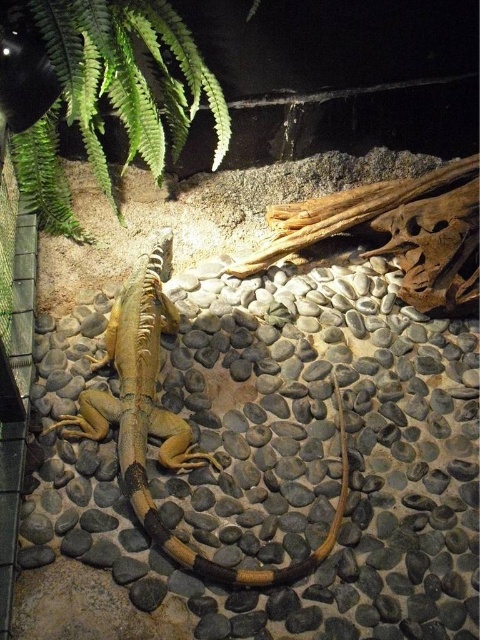
You are a small insect in the terrarium. You want to move from the smooth tan lizard at center to the green leafy plant at upper left. Which direction should you go?

The green leafy plant at upper left is to the left of the smooth tan lizard at center, so you should move to the left to reach it.

You are a reptile keeper and need to ensure the smooth tan lizard at center can reach the green leafy plant at upper left for feeding. The lizard can stretch up to 30 inches. Can it reach the plant?

The green leafy plant at upper left and smooth tan lizard at center are 31.44 inches apart, so the lizard cannot reach the plant as its maximum stretch is 30 inches.

You are a reptile keeper checking the terrarium. You notice the green leafy plant at upper left and the smooth tan lizard at center. Which object is smaller in size?

The green leafy plant at upper left is smaller in size compared to the smooth tan lizard at center.